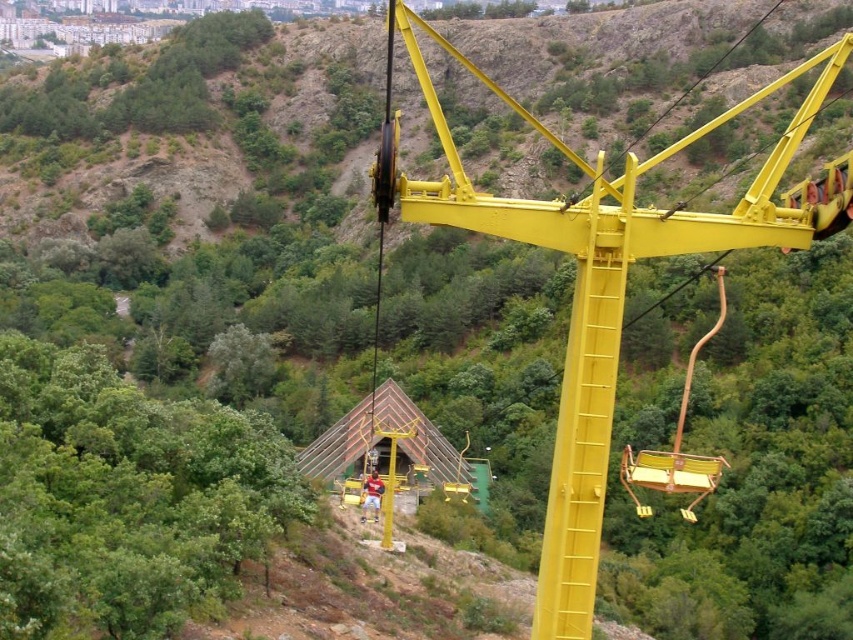
Locate an element on the screen. The image size is (853, 640). yellow metallic crane at center is located at coordinates (604, 282).

Who is taller, yellow metallic crane at center or metallic yellow swing at right?

Standing taller between the two is yellow metallic crane at center.

Is point (579, 419) farther from viewer compared to point (689, 484)?

No, it is not.

Locate an element on the screen. yellow metallic crane at center is located at coordinates (604, 282).

Can you confirm if transparent plastic hut at center is positioned to the right of metallic yellow swing at right?

In fact, transparent plastic hut at center is to the left of metallic yellow swing at right.

Measure the distance from transparent plastic hut at center to metallic yellow swing at right.

transparent plastic hut at center and metallic yellow swing at right are 19.25 meters apart from each other.

Does point (409, 467) come behind point (695, 502)?

Yes, it is behind point (695, 502).

The image size is (853, 640). I want to click on transparent plastic hut at center, so click(387, 449).

Can you confirm if yellow metallic crane at center is smaller than transparent plastic hut at center?

Actually, yellow metallic crane at center might be larger than transparent plastic hut at center.

Is yellow metallic crane at center further to the viewer compared to transparent plastic hut at center?

No, yellow metallic crane at center is in front of transparent plastic hut at center.

The image size is (853, 640). In order to click on yellow metallic crane at center in this screenshot , I will do `click(604, 282)`.